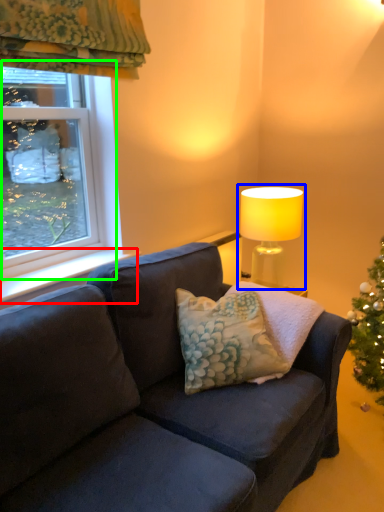
Question: Considering the real-world distances, which object is farthest from window sill (highlighted by a red box)? lamp (highlighted by a blue box) or window (highlighted by a green box)?

Choices:
 (A) lamp
 (B) window

Answer: (A)